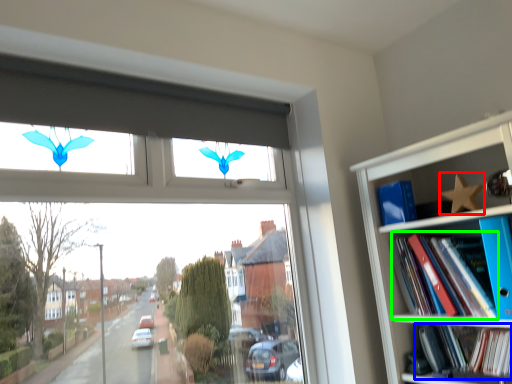
Question: Based on their relative distances, which object is nearer to butterfly (highlighted by a red box)? Choose from book (highlighted by a blue box) and book (highlighted by a green box).

Choices:
 (A) book
 (B) book

Answer: (B)